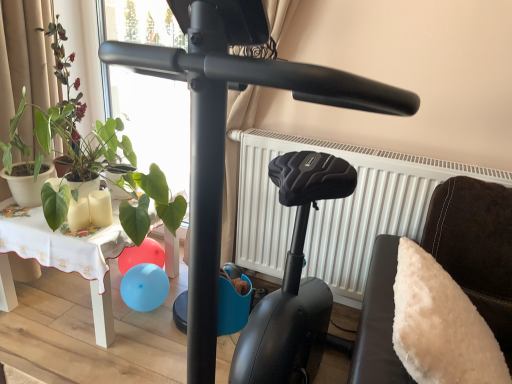
Where is `green matte plant at left`? green matte plant at left is located at coordinates (23, 165).

This screenshot has height=384, width=512. In order to click on white fabric-covered table at lower left in this screenshot , I will do `click(65, 261)`.

Describe the element at coordinates (65, 261) in the screenshot. I see `white fabric-covered table at lower left` at that location.

What are the coordinates of `white matte radiator at center` in the screenshot? It's located at (337, 208).

Where is `green matte plant at left`? This screenshot has height=384, width=512. green matte plant at left is located at coordinates point(23,165).

From a real-world perspective, which is physically below, green leafy plant at left, which is counted as the second plant, starting from the top, or green matte plant at left, which is the first plant in top-to-bottom order?

From a 3D spatial view, green leafy plant at left, which is counted as the second plant, starting from the top, is below.

Is green leafy plant at left, which is counted as the second plant, starting from the top, positioned before green matte plant at left, which is the first plant in top-to-bottom order?

Yes, the depth of green leafy plant at left, which is counted as the second plant, starting from the top, is less than that of green matte plant at left, which is the first plant in top-to-bottom order.

Considering the sizes of objects green leafy plant at left, the 1th plant from the bottom, and green matte plant at left, which is the first plant in top-to-bottom order, in the image provided, who is bigger, green leafy plant at left, the 1th plant from the bottom, or green matte plant at left, which is the first plant in top-to-bottom order,?

Bigger between the two is green leafy plant at left, the 1th plant from the bottom.

Is green leafy plant at left, the 1th plant from the bottom, beside green matte plant at left, which is the first plant in top-to-bottom order?

green leafy plant at left, the 1th plant from the bottom, is not next to green matte plant at left, which is the first plant in top-to-bottom order, and they're not touching.

Does white fluffy pillow at right have a larger size compared to green matte plant at left, which is the first plant in top-to-bottom order?

Yes, white fluffy pillow at right is bigger than green matte plant at left, which is the first plant in top-to-bottom order.

Between white fluffy pillow at right and green matte plant at left, the second plant when ordered from bottom to top, which one has larger width?

white fluffy pillow at right is wider.

From the image's perspective, is white fluffy pillow at right above green matte plant at left, which is the first plant in top-to-bottom order?

No, from the image's perspective, white fluffy pillow at right is not above green matte plant at left, which is the first plant in top-to-bottom order.

Is white fluffy pillow at right to the right of green matte plant at left, the second plant when ordered from bottom to top, from the viewer's perspective?

Correct, you'll find white fluffy pillow at right to the right of green matte plant at left, the second plant when ordered from bottom to top.

From the image's perspective, which is above, white matte radiator at center or green leafy plant at left, the 1th plant from the bottom?

green leafy plant at left, the 1th plant from the bottom, is shown above in the image.

Which of these two, white matte radiator at center or green leafy plant at left, which is counted as the second plant, starting from the top, stands shorter?

With less height is green leafy plant at left, which is counted as the second plant, starting from the top.

Between point (388, 163) and point (137, 228), which one is positioned in front?

The point (137, 228) is closer to the camera.

Would you say white matte radiator at center is to the left or to the right of green leafy plant at left, the 1th plant from the bottom, in the picture?

white matte radiator at center is to the right of green leafy plant at left, the 1th plant from the bottom.

Is green matte plant at left, which is the first plant in top-to-bottom order, beside green matte plant at left?

green matte plant at left, which is the first plant in top-to-bottom order, and green matte plant at left are not in contact.

In terms of size, does green matte plant at left, which is the first plant in top-to-bottom order, appear bigger or smaller than green matte plant at left?

Clearly, green matte plant at left, which is the first plant in top-to-bottom order, is larger in size than green matte plant at left.

Is green matte plant at left, the second plant when ordered from bottom to top, wider or thinner than green matte plant at left?

Considering their sizes, green matte plant at left, the second plant when ordered from bottom to top, looks broader than green matte plant at left.

Is white fluffy pillow at right positioned with its back to green leafy plant at left, the 1th plant from the bottom?

white fluffy pillow at right is not turned away from green leafy plant at left, the 1th plant from the bottom.

Considering the sizes of objects white fluffy pillow at right and green leafy plant at left, which is counted as the second plant, starting from the top, in the image provided, who is bigger, white fluffy pillow at right or green leafy plant at left, which is counted as the second plant, starting from the top,?

green leafy plant at left, which is counted as the second plant, starting from the top, is bigger.

Where is `furniture in front of the green leafy plant at left, the 1th plant from the bottom`? The image size is (512, 384). furniture in front of the green leafy plant at left, the 1th plant from the bottom is located at coordinates (476, 247).

Considering the relative positions of white fluffy pillow at right and green leafy plant at left, the 1th plant from the bottom, in the image provided, is white fluffy pillow at right to the left or to the right of green leafy plant at left, the 1th plant from the bottom,?

white fluffy pillow at right is positioned on green leafy plant at left, the 1th plant from the bottom,'s right side.

Which object is thinner, green leafy plant at left, the 1th plant from the bottom, or black matte stationary bicycle at center?

Thinner between the two is green leafy plant at left, the 1th plant from the bottom.

Which point is more forward, (35, 113) or (295, 89)?

The point (295, 89) is more forward.

Is green leafy plant at left, the 1th plant from the bottom, looking in the opposite direction of black matte stationary bicycle at center?

No, black matte stationary bicycle at center is not at the back of green leafy plant at left, the 1th plant from the bottom.

Is green leafy plant at left, which is counted as the second plant, starting from the top, in front of or behind black matte stationary bicycle at center in the image?

Clearly, green leafy plant at left, which is counted as the second plant, starting from the top, is behind black matte stationary bicycle at center.

Can you confirm if white fluffy pillow at right is bigger than white fabric-covered table at lower left?

Actually, white fluffy pillow at right might be smaller than white fabric-covered table at lower left.

Considering the relative sizes of white fluffy pillow at right and white fabric-covered table at lower left in the image provided, is white fluffy pillow at right taller than white fabric-covered table at lower left?

Incorrect, the height of white fluffy pillow at right is not larger of that of white fabric-covered table at lower left.

In the scene shown: Which object is positioned more to the right, white fluffy pillow at right or white fabric-covered table at lower left?

From the viewer's perspective, white fluffy pillow at right appears more on the right side.

Could you tell me if white fluffy pillow at right is facing white fabric-covered table at lower left?

No, white fluffy pillow at right is not aimed at white fabric-covered table at lower left.

Locate an element on the screen. The height and width of the screenshot is (384, 512). plant above the green leafy plant at left, the 1th plant from the bottom (from a real-world perspective) is located at coordinates (66, 83).

Find the location of a particular element. The image size is (512, 384). plant that is the 2nd one when counting upward from the white fluffy pillow at right (from the image's perspective) is located at coordinates (66, 83).

When comparing their distances from white matte radiator at center, does white fabric-covered table at lower left or green leafy plant at left, which is counted as the second plant, starting from the top, seem further?

white fabric-covered table at lower left is further to white matte radiator at center.

Considering their positions, is black matte stationary bicycle at center positioned closer to green leafy plant at left, which is counted as the second plant, starting from the top, than white matte radiator at center?

white matte radiator at center is closer to green leafy plant at left, which is counted as the second plant, starting from the top.

Considering their positions, is green leafy plant at left, the 1th plant from the bottom, positioned closer to white fabric-covered table at lower left than green matte plant at left, which is the first plant in top-to-bottom order?

green leafy plant at left, the 1th plant from the bottom.

Which object lies further to the anchor point green leafy plant at left, which is counted as the second plant, starting from the top, green matte plant at left or green matte plant at left, the second plant when ordered from bottom to top?

green matte plant at left lies further to green leafy plant at left, which is counted as the second plant, starting from the top, than the other object.

Which object lies further to the anchor point green matte plant at left, the second plant when ordered from bottom to top, green leafy plant at left, which is counted as the second plant, starting from the top, or black matte stationary bicycle at center?

Based on the image, black matte stationary bicycle at center appears to be further to green matte plant at left, the second plant when ordered from bottom to top.

When comparing their distances from white matte radiator at center, does white fluffy pillow at right or white fabric-covered table at lower left seem closer?

white fluffy pillow at right is positioned closer to the anchor white matte radiator at center.

From the image, which object appears to be farther from white matte radiator at center, green leafy plant at left, which is counted as the second plant, starting from the top, or green matte plant at left?

green matte plant at left is positioned further to the anchor white matte radiator at center.

From the image, which object appears to be nearer to white matte radiator at center, white fabric-covered table at lower left or black matte stationary bicycle at center?

The object closer to white matte radiator at center is white fabric-covered table at lower left.

At what (x,y) coordinates should I click in order to perform the action: click on stationary bicycle between green matte plant at left and white fluffy pillow at right. Please return your answer as a coordinate pair (x, y). Image resolution: width=512 pixels, height=384 pixels. Looking at the image, I should click on (224, 127).

I want to click on stationary bicycle located between green matte plant at left and white matte radiator at center in the left-right direction, so click(x=224, y=127).

Find the location of a particular element. This screenshot has width=512, height=384. radiator between green leafy plant at left, which is counted as the second plant, starting from the top, and white fluffy pillow at right from left to right is located at coordinates (337, 208).

Where is `table situated between green matte plant at left, which is the first plant in top-to-bottom order, and white matte radiator at center from left to right`? This screenshot has width=512, height=384. table situated between green matte plant at left, which is the first plant in top-to-bottom order, and white matte radiator at center from left to right is located at coordinates (65, 261).